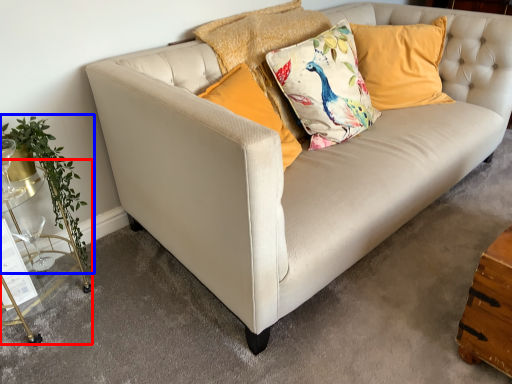
Question: Which point is further to the camera, table (highlighted by a red box) or plant (highlighted by a blue box)?

Choices:
 (A) table
 (B) plant

Answer: (B)